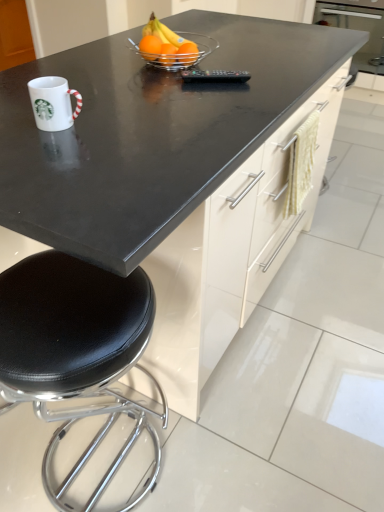
What are the coordinates of `empty space that is to the right of orange matte at center, which ranks as the 1th orange in left-to-right order` in the screenshot? It's located at (216, 64).